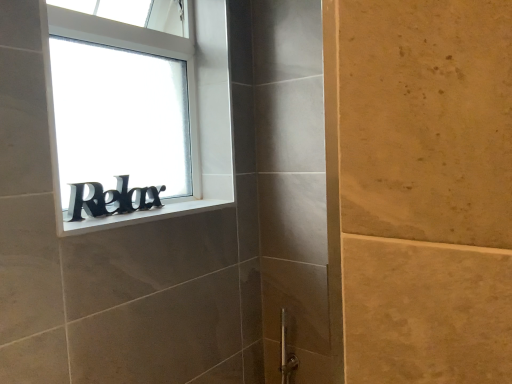
Question: Is point pos(224,203) positioned closer to the camera than point pos(79,66)?

Choices:
 (A) closer
 (B) farther

Answer: (B)

Question: Considering the relative positions of white matte window sill at upper left and black matte sign at upper left in the image provided, is white matte window sill at upper left to the left or to the right of black matte sign at upper left?

Choices:
 (A) right
 (B) left

Answer: (A)

Question: Based on their relative distances, which object is farther from the black matte sign at window?

Choices:
 (A) black matte sign at upper left
 (B) white matte window sill at upper left

Answer: (A)

Question: Which object is the closest to the black matte sign at window?

Choices:
 (A) white matte window sill at upper left
 (B) black matte sign at upper left

Answer: (A)